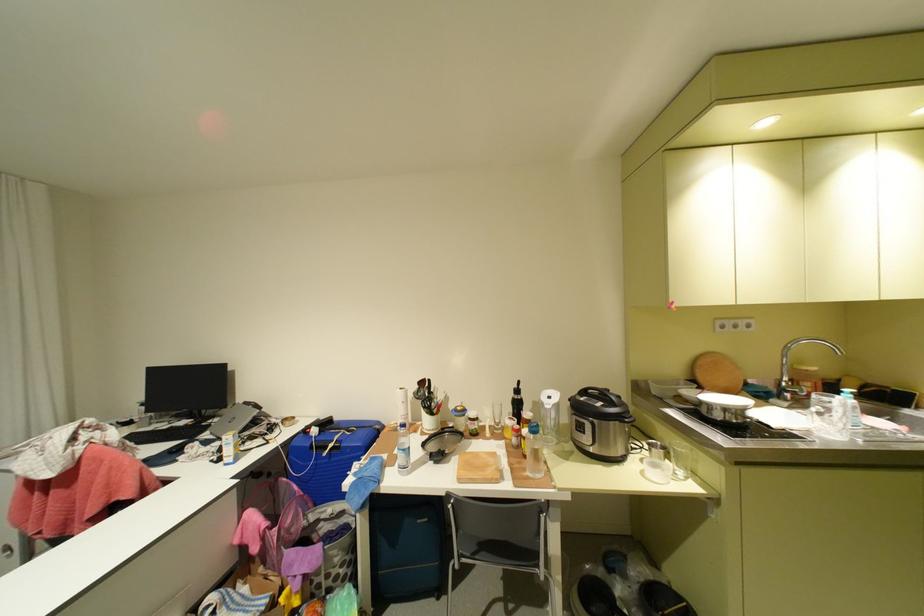
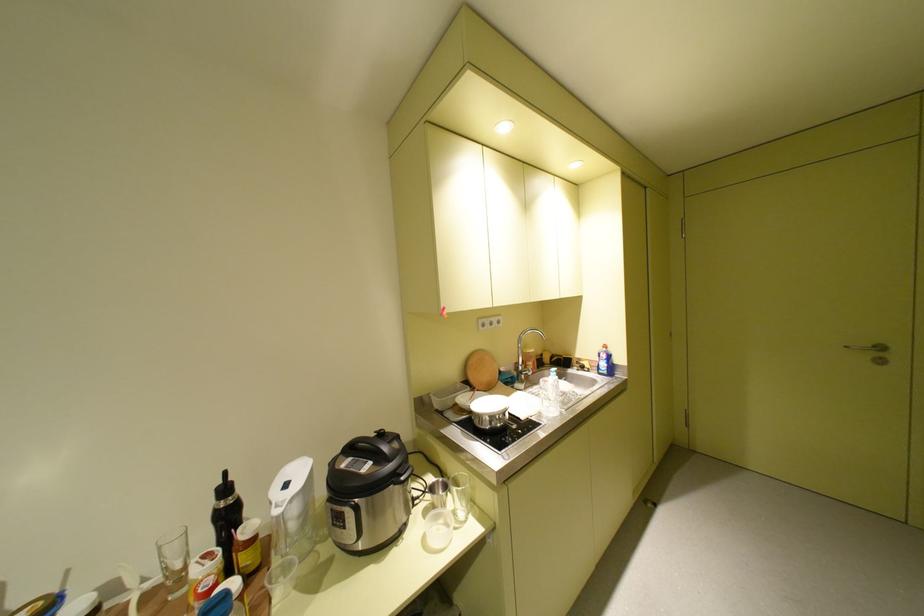
Question: The images are taken continuously from a first-person perspective. In which direction is your viewpoint rotating?

Choices:
 (A) Left
 (B) Right
 (C) Up
 (D) Down

Answer: (B)